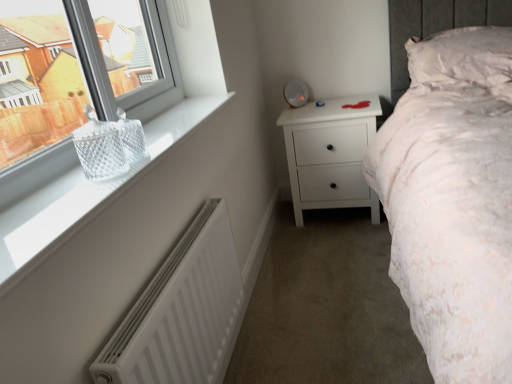
Question: Is white matte chest of drawers at center shorter than white textured pillow at upper right?

Choices:
 (A) no
 (B) yes

Answer: (A)

Question: Considering the relative positions of white matte chest of drawers at center and white textured pillow at upper right in the image provided, is white matte chest of drawers at center to the right of white textured pillow at upper right from the viewer's perspective?

Choices:
 (A) no
 (B) yes

Answer: (A)

Question: Considering the relative sizes of white matte chest of drawers at center and white textured pillow at upper right in the image provided, is white matte chest of drawers at center taller than white textured pillow at upper right?

Choices:
 (A) no
 (B) yes

Answer: (B)

Question: Is white matte chest of drawers at center far from white textured pillow at upper right?

Choices:
 (A) no
 (B) yes

Answer: (A)

Question: Are white matte chest of drawers at center and white textured pillow at upper right beside each other?

Choices:
 (A) no
 (B) yes

Answer: (A)

Question: From the image's perspective, does white matte chest of drawers at center appear lower than white textured pillow at upper right?

Choices:
 (A) yes
 (B) no

Answer: (A)

Question: From the image's perspective, is clear glass basket at left, which is the second window from top to bottom, below white matte radiator at lower left?

Choices:
 (A) no
 (B) yes

Answer: (A)

Question: Is clear glass basket at left, which is the second window from top to bottom, oriented away from white matte radiator at lower left?

Choices:
 (A) no
 (B) yes

Answer: (A)

Question: Could you tell me if clear glass basket at left, which is the second window from top to bottom, is turned towards white matte radiator at lower left?

Choices:
 (A) yes
 (B) no

Answer: (B)

Question: Can you confirm if clear glass basket at left, which appears as the 1th window when ordered from the bottom, is positioned to the right of white matte radiator at lower left?

Choices:
 (A) yes
 (B) no

Answer: (B)

Question: Is clear glass basket at left, which is the second window from top to bottom, in front of white matte radiator at lower left?

Choices:
 (A) no
 (B) yes

Answer: (B)

Question: Does clear glass basket at left, which appears as the 1th window when ordered from the bottom, have a greater height compared to white matte radiator at lower left?

Choices:
 (A) yes
 (B) no

Answer: (B)

Question: From the image's perspective, is clear glass basket at left, which is the second window from top to bottom, beneath white textured pillow at upper right?

Choices:
 (A) yes
 (B) no

Answer: (A)